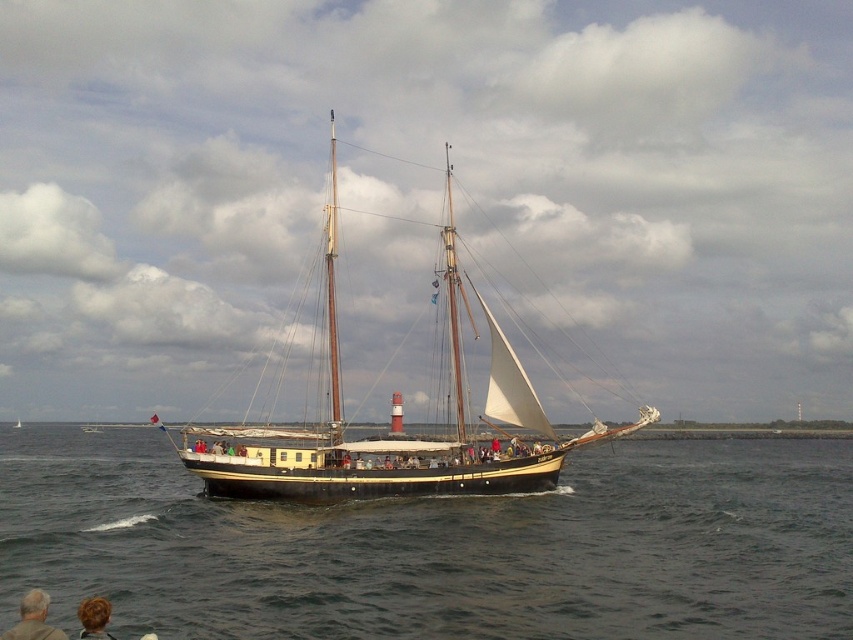
Consider the image. Can you confirm if gray hair at lower left is positioned to the right of blonde hair at lower left?

No, gray hair at lower left is not to the right of blonde hair at lower left.

Is point (18, 634) closer to camera compared to point (83, 616)?

Yes.

Locate an element on the screen. The width and height of the screenshot is (853, 640). gray hair at lower left is located at coordinates (33, 618).

Between dark blue water at center and gray hair at lower left, which one appears on the left side from the viewer's perspective?

Positioned to the left is gray hair at lower left.

Can you confirm if dark blue water at center is positioned below gray hair at lower left?

Indeed, dark blue water at center is positioned under gray hair at lower left.

You are a GUI agent. You are given a task and a screenshot of the screen. Output one action in this format:
    pyautogui.click(x=<x>, y=<y>)
    Task: Click on the dark blue water at center
    This screenshot has width=853, height=640.
    Given the screenshot: What is the action you would take?
    pyautogui.click(x=439, y=547)

Does dark blue water at center appear on the left side of blonde hair at lower left?

No, dark blue water at center is not to the left of blonde hair at lower left.

What do you see at coordinates (439, 547) in the screenshot?
I see `dark blue water at center` at bounding box center [439, 547].

Find the location of a particular element. The width and height of the screenshot is (853, 640). dark blue water at center is located at coordinates (439, 547).